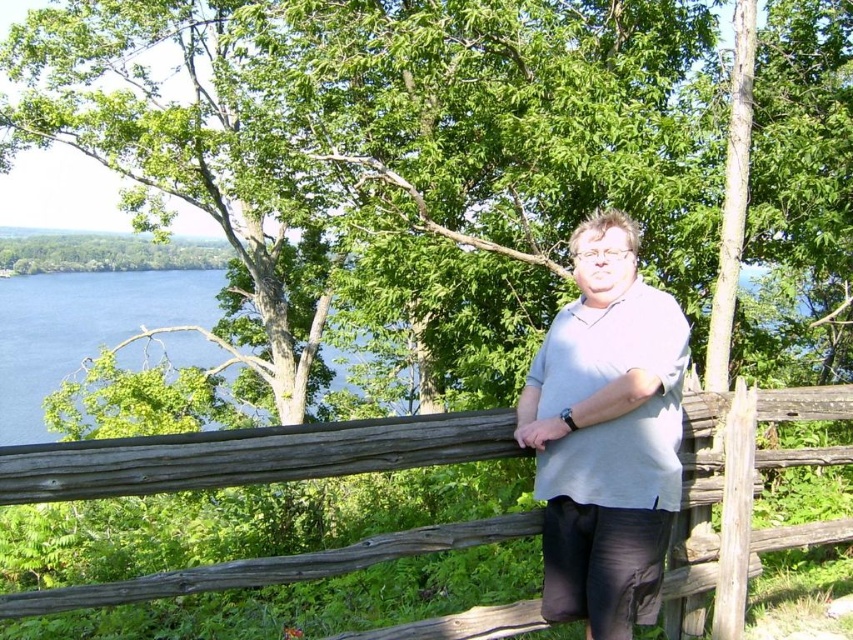
Locate an element on the screen. weathered wood fence at center is located at coordinates (245, 456).

Can you confirm if weathered wood fence at center is positioned to the right of light gray cotton shirt at center?

Indeed, weathered wood fence at center is positioned on the right side of light gray cotton shirt at center.

The width and height of the screenshot is (853, 640). Find the location of `weathered wood fence at center`. weathered wood fence at center is located at coordinates (245, 456).

Measure the distance between light gray cotton shirt at center and camera.

light gray cotton shirt at center is 9.45 feet from camera.

Who is lower down, light gray cotton shirt at center or blue liquid water at left?

light gray cotton shirt at center is below.

Which is in front, point (538, 467) or point (117, 280)?

Point (538, 467) is in front.

Where is `light gray cotton shirt at center`? The width and height of the screenshot is (853, 640). light gray cotton shirt at center is located at coordinates (606, 435).

Is point (492, 454) in front of point (212, 358)?

Yes, it is.

Which of these two, weathered wood fence at center or blue liquid water at left, stands taller?

blue liquid water at left is taller.

Describe the element at coordinates (245, 456) in the screenshot. This screenshot has width=853, height=640. I see `weathered wood fence at center` at that location.

You are a GUI agent. You are given a task and a screenshot of the screen. Output one action in this format:
    pyautogui.click(x=<x>, y=<y>)
    Task: Click on the weathered wood fence at center
    The height and width of the screenshot is (640, 853).
    Given the screenshot: What is the action you would take?
    pyautogui.click(x=245, y=456)